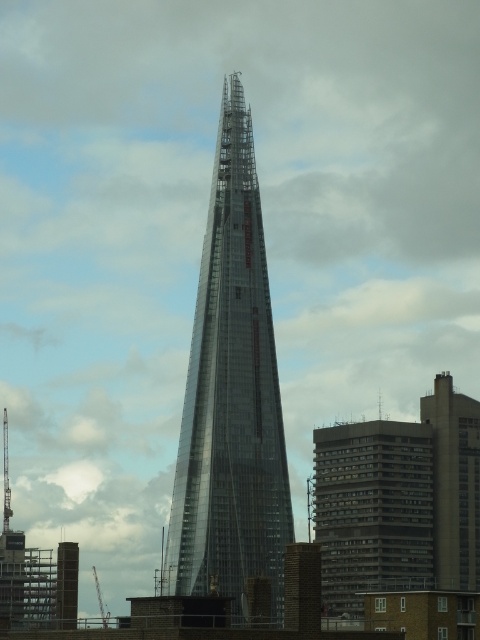
You are an architect analyzing the layout of the buildings in the image. Which of the two structures, the transparent glass tower at center or the transparent glass spire at left, is positioned higher in the image?

The transparent glass tower at center is positioned higher in the image as it is located above the transparent glass spire at left.

You are standing in front of The Shard in London and want to take a photo of both the transparent glass tower at center and the transparent glass spire at left. Which object should you position to the right side of your camera frame to include both in the shot?

You should position the transparent glass tower at center to the right side of your camera frame because it is already located to the right of the transparent glass spire at left, ensuring both are captured in the photo.

You are a drone operator planning to fly a drone between the transparent glass tower at center and the transparent glass spire at left. Given that the drone has a maximum flight height of 300 meters, can it safely navigate between them without hitting either structure?

The transparent glass tower at center is taller than the transparent glass spire at left. However, without specific height measurements for both structures, it is impossible to determine if the drone can safely navigate between them at 300 meters. Additional information about their actual heights is required to provide a definitive answer.